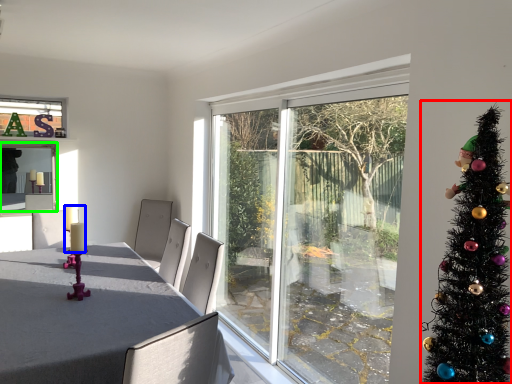
Question: Which object is positioned closest to christmas tree (highlighted by a red box)? Select from candle (highlighted by a blue box) and window screen (highlighted by a green box).

Choices:
 (A) candle
 (B) window screen

Answer: (A)